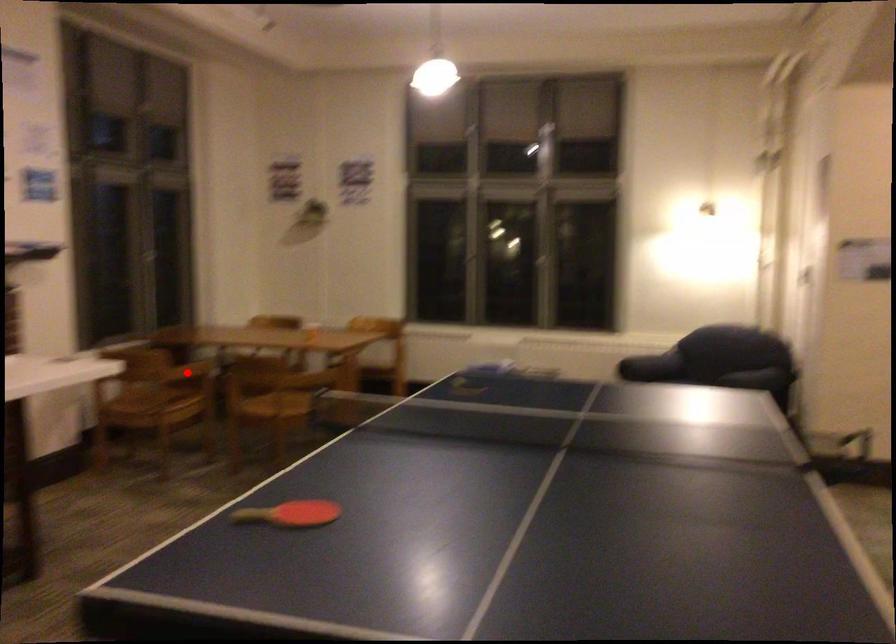
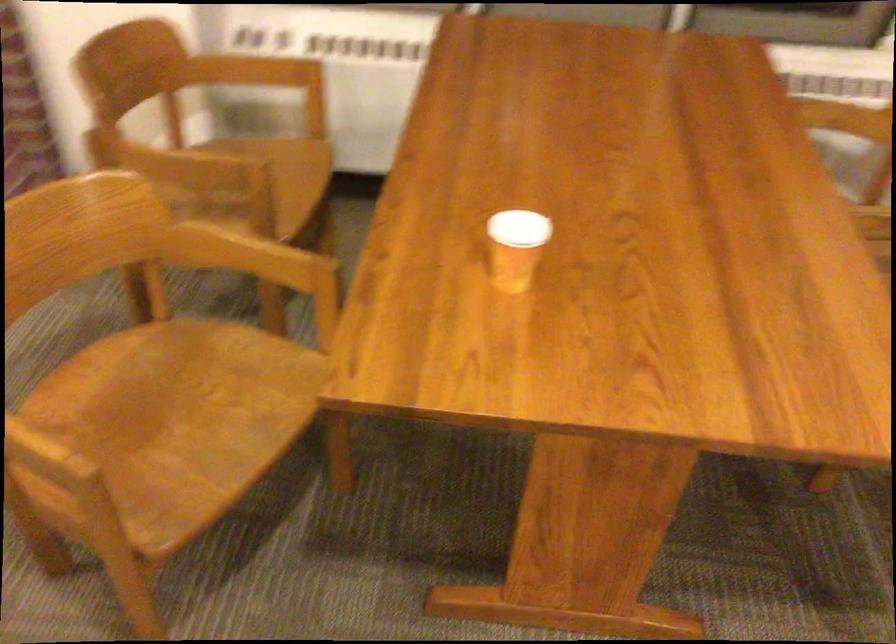
Question: I am providing you with two images of the same scene from different viewpoints. Given a red point in image1, look at the same physical point in image2. Is it:

Choices:
 (A) Closer to the viewpoint
 (B) Farther from the viewpoint

Answer: (A)